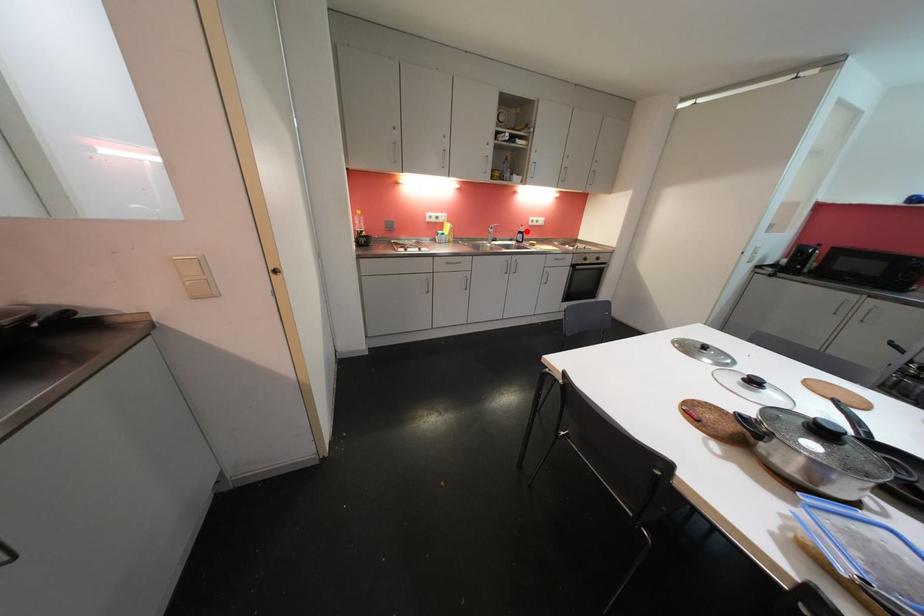
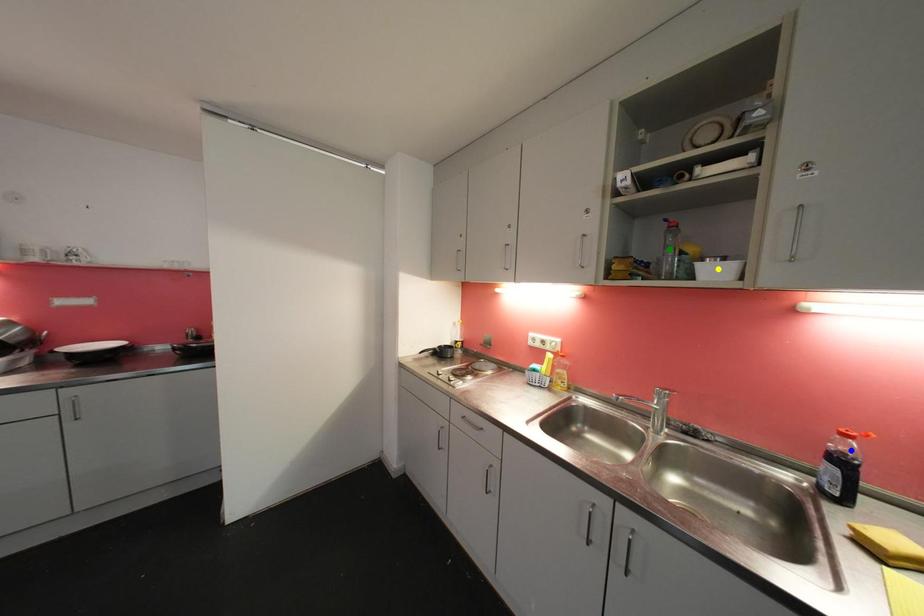
Question: I am providing you with two images of the same scene from different viewpoints. A red point is marked on the first image. You are given multiple points on the second image. Which mark in image 2 goes with the point in image 1?

Choices:
 (A) blue point
 (B) yellow point
 (C) green point

Answer: (A)